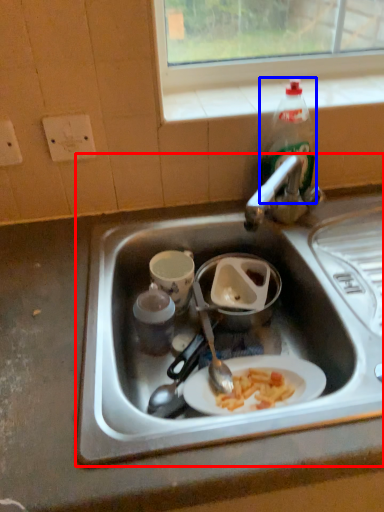
Question: Among these objects, which one is nearest to the camera, sink (highlighted by a red box) or bottle (highlighted by a blue box)?

Choices:
 (A) sink
 (B) bottle

Answer: (A)